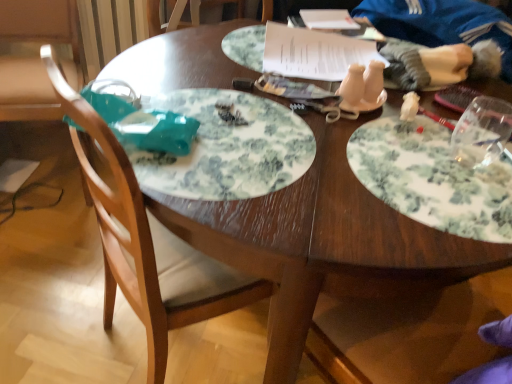
Question: Considering the positions of white paper at upper center and white floral plate at right, acting as the 2th plate starting from the left, in the image, is white paper at upper center bigger or smaller than white floral plate at right, acting as the 2th plate starting from the left,?

Choices:
 (A) big
 (B) small

Answer: (A)

Question: Would you say white paper at upper center is to the left or to the right of white floral plate at right, acting as the 2th plate starting from the left, in the picture?

Choices:
 (A) left
 (B) right

Answer: (A)

Question: Which object is positioned farthest from the white floral plate at center, which is the second plate from right to left?

Choices:
 (A) wooden chair at left
 (B) white paper at upper center
 (C) white fabric doll at upper right
 (D) white floral plate at right, acting as the 2th plate starting from the left

Answer: (C)

Question: Estimate the real-world distances between objects in this image. Which object is farther from the white floral plate at center, which is the second plate from right to left?

Choices:
 (A) white fabric doll at upper right
 (B) white floral plate at right, acting as the 2th plate starting from the left
 (C) wooden chair at left
 (D) white paper at upper center

Answer: (A)